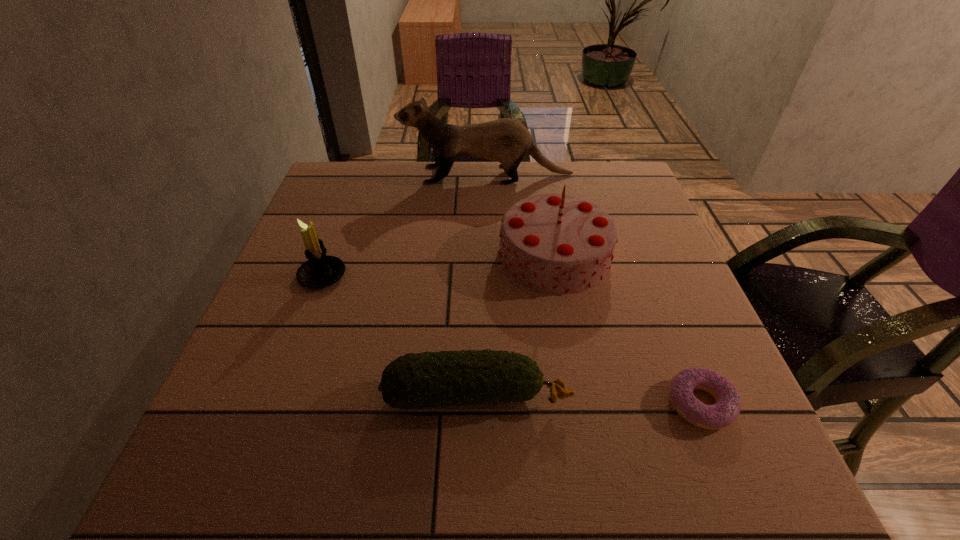
In order to click on vacant area between the fourth tallest object and the birthday cake in this screenshot , I will do `click(516, 326)`.

The image size is (960, 540). Find the location of `empty space that is in between the second shortest object and the birthday cake`. empty space that is in between the second shortest object and the birthday cake is located at coordinates (516, 326).

I want to click on vacant space in between the cucumber and the birthday cake, so click(516, 326).

Identify the location of empty space between the candle holder and the birthday cake. (439, 266).

Choose which object is the third nearest neighbor to the candle holder. Please provide its 2D coordinates. Your answer should be formatted as a tuple, i.e. [(x, y)], where the tuple contains the x and y coordinates of a point satisfying the conditions above.

[(560, 244)]

Identify which object is located as the nearest to the birthday cake. Please provide its 2D coordinates. Your answer should be formatted as a tuple, i.e. [(x, y)], where the tuple contains the x and y coordinates of a point satisfying the conditions above.

[(505, 140)]

Locate an element on the screen. The image size is (960, 540). free space that satisfies the following two spatial constraints: 1. on the face of the farthest object; 2. on the right side of the shortest object is located at coordinates (492, 404).

Find the location of `vacant space that satisfies the following two spatial constraints: 1. on the face of the ferret; 2. on the left side of the birthday cake`. vacant space that satisfies the following two spatial constraints: 1. on the face of the ferret; 2. on the left side of the birthday cake is located at coordinates (489, 255).

Locate an element on the screen. blank space that satisfies the following two spatial constraints: 1. on the face of the farthest object; 2. on the front side of the candle holder is located at coordinates (490, 276).

You are a GUI agent. You are given a task and a screenshot of the screen. Output one action in this format:
    pyautogui.click(x=<x>, y=<y>)
    Task: Click on the vacant area that satisfies the following two spatial constraints: 1. on the face of the farthest object; 2. on the front side of the candle holder
    The image size is (960, 540).
    Given the screenshot: What is the action you would take?
    pyautogui.click(x=490, y=276)